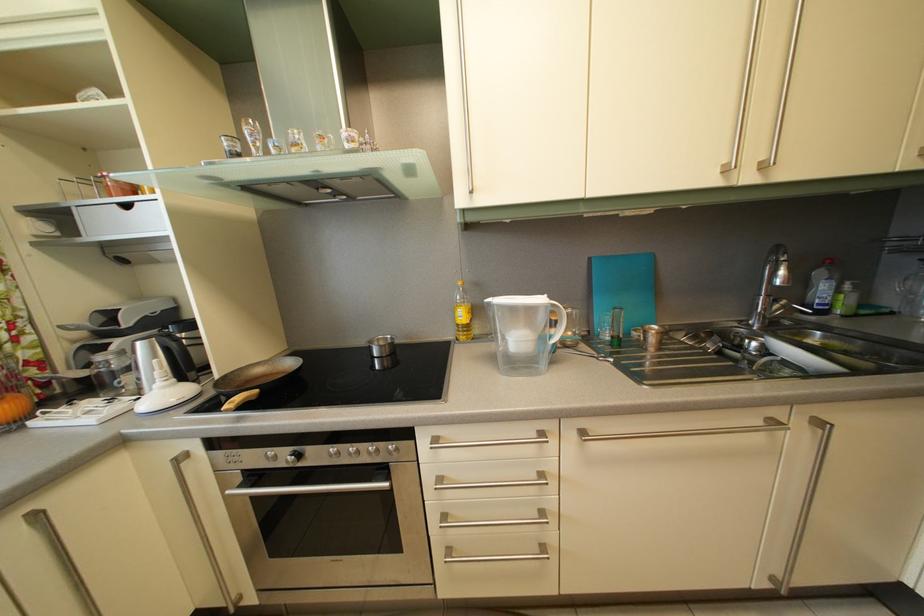
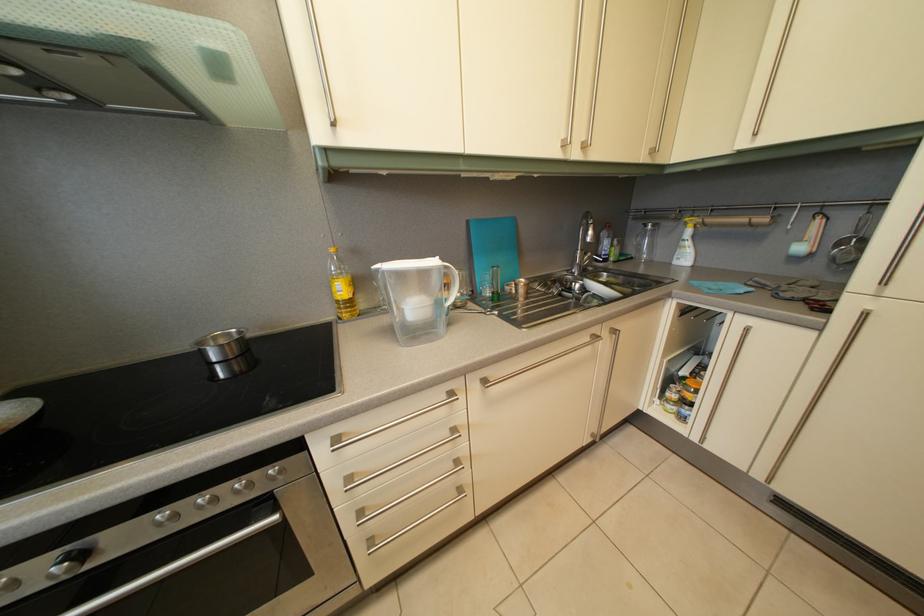
The point at (447, 487) is marked in the first image. Where is the corresponding point in the second image?

(358, 487)